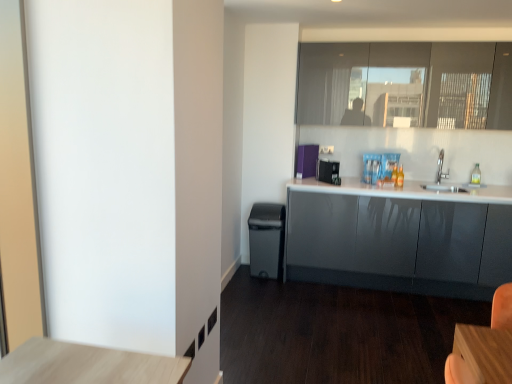
Question: Is matte black trash can at lower center thinner than purple fabric at upper center, positioned as the 2th appliance in front-to-back order?

Choices:
 (A) no
 (B) yes

Answer: (A)

Question: Would you consider matte black trash can at lower center to be distant from purple fabric at upper center, positioned as the 2th appliance in front-to-back order?

Choices:
 (A) yes
 (B) no

Answer: (B)

Question: Does matte black trash can at lower center have a larger size compared to purple fabric at upper center, which ranks as the 1th appliance in back-to-front order?

Choices:
 (A) no
 (B) yes

Answer: (B)

Question: From the image's perspective, does matte black trash can at lower center appear higher than purple fabric at upper center, positioned as the 2th appliance in front-to-back order?

Choices:
 (A) yes
 (B) no

Answer: (B)

Question: From a real-world perspective, does matte black trash can at lower center stand above purple fabric at upper center, positioned as the 2th appliance in front-to-back order?

Choices:
 (A) yes
 (B) no

Answer: (B)

Question: Can you confirm if matte black trash can at lower center is smaller than purple fabric at upper center, which ranks as the 1th appliance in back-to-front order?

Choices:
 (A) yes
 (B) no

Answer: (B)

Question: Is glossy gray cabinets at right not close to purple fabric at upper center, which ranks as the 1th appliance in back-to-front order?

Choices:
 (A) no
 (B) yes

Answer: (B)

Question: From the image's perspective, is glossy gray cabinets at right below purple fabric at upper center, which ranks as the 1th appliance in back-to-front order?

Choices:
 (A) no
 (B) yes

Answer: (B)

Question: Is glossy gray cabinets at right wider than purple fabric at upper center, positioned as the 2th appliance in front-to-back order?

Choices:
 (A) no
 (B) yes

Answer: (B)

Question: Considering the relative sizes of glossy gray cabinets at right and purple fabric at upper center, which ranks as the 1th appliance in back-to-front order, in the image provided, is glossy gray cabinets at right thinner than purple fabric at upper center, which ranks as the 1th appliance in back-to-front order,?

Choices:
 (A) yes
 (B) no

Answer: (B)

Question: Is glossy gray cabinets at right facing away from purple fabric at upper center, which ranks as the 1th appliance in back-to-front order?

Choices:
 (A) no
 (B) yes

Answer: (A)

Question: From the image's perspective, would you say glossy gray cabinets at right is positioned over purple fabric at upper center, positioned as the 2th appliance in front-to-back order?

Choices:
 (A) no
 (B) yes

Answer: (A)

Question: From a real-world perspective, is black plastic toaster at center, the second appliance in the back-to-front sequence, physically below transparent plastic bottle at right?

Choices:
 (A) yes
 (B) no

Answer: (A)